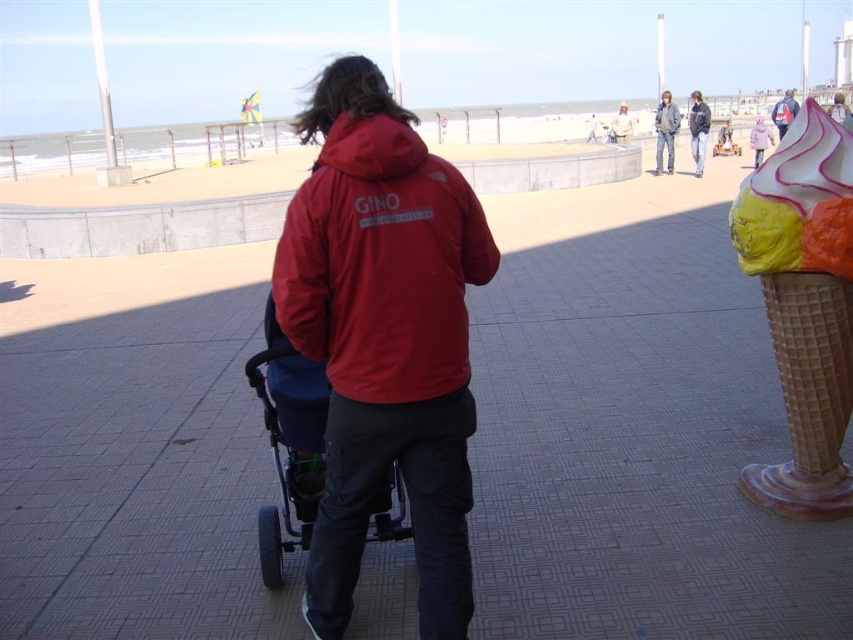
This screenshot has height=640, width=853. What do you see at coordinates (289, 442) in the screenshot? I see `blue fabric baby carriage at center` at bounding box center [289, 442].

The width and height of the screenshot is (853, 640). Find the location of `blue fabric baby carriage at center`. blue fabric baby carriage at center is located at coordinates (289, 442).

Which is behind, point (677, 115) or point (654, 122)?

Positioned behind is point (654, 122).

Which is more to the right, denim jacket at upper right or matte red jacket at center?

denim jacket at upper right is more to the right.

Identify the location of denim jacket at upper right. This screenshot has width=853, height=640. (665, 131).

Identify the location of denim jacket at upper right. (665, 131).

Can you confirm if dark gray jacket at upper right is positioned below blue denim jacket at upper right?

Correct, dark gray jacket at upper right is located below blue denim jacket at upper right.

You are a GUI agent. You are given a task and a screenshot of the screen. Output one action in this format:
    pyautogui.click(x=<x>, y=<y>)
    Task: Click on the dark gray jacket at upper right
    
    Given the screenshot: What is the action you would take?
    pyautogui.click(x=698, y=131)

I want to click on dark gray jacket at upper right, so click(x=698, y=131).